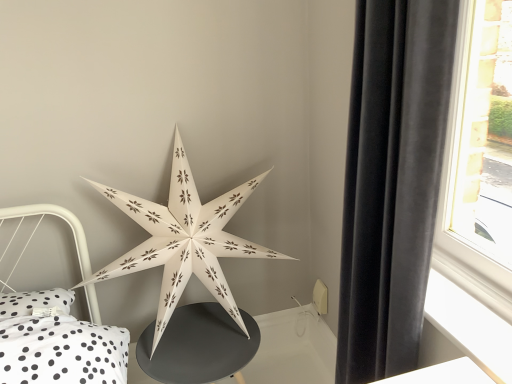
Question: Is velvet black curtain at right bigger than white paper star at center?

Choices:
 (A) yes
 (B) no

Answer: (B)

Question: Is velvet black curtain at right oriented away from white paper star at center?

Choices:
 (A) no
 (B) yes

Answer: (A)

Question: Is velvet black curtain at right next to white paper star at center and touching it?

Choices:
 (A) no
 (B) yes

Answer: (A)

Question: Is velvet black curtain at right further to camera compared to white paper star at center?

Choices:
 (A) no
 (B) yes

Answer: (A)

Question: From the image's perspective, does velvet black curtain at right appear lower than white paper star at center?

Choices:
 (A) yes
 (B) no

Answer: (B)

Question: Looking at the image, does matte black table at center seem bigger or smaller compared to white paper star at center?

Choices:
 (A) big
 (B) small

Answer: (B)

Question: Is matte black table at center to the left or to the right of white paper star at center in the image?

Choices:
 (A) left
 (B) right

Answer: (B)

Question: From a real-world perspective, is matte black table at center positioned above or below white paper star at center?

Choices:
 (A) above
 (B) below

Answer: (B)

Question: Is matte black table at center inside the boundaries of white paper star at center, or outside?

Choices:
 (A) outside
 (B) inside

Answer: (A)

Question: Is velvet black curtain at right taller or shorter than white paper star at center?

Choices:
 (A) short
 (B) tall

Answer: (B)

Question: From a real-world perspective, is velvet black curtain at right above or below white paper star at center?

Choices:
 (A) below
 (B) above

Answer: (B)

Question: Relative to white paper star at center, is velvet black curtain at right in front or behind?

Choices:
 (A) behind
 (B) front

Answer: (B)

Question: Is velvet black curtain at right inside the boundaries of white paper star at center, or outside?

Choices:
 (A) outside
 (B) inside

Answer: (A)

Question: From the image's perspective, relative to velvet black curtain at right, is white paper star at center above or below?

Choices:
 (A) above
 (B) below

Answer: (B)

Question: Is white paper star at center bigger or smaller than velvet black curtain at right?

Choices:
 (A) small
 (B) big

Answer: (B)